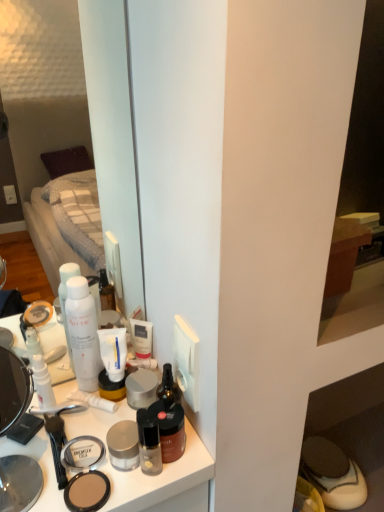
This screenshot has height=512, width=384. Describe the element at coordinates (164, 482) in the screenshot. I see `matte plastic makeup at center` at that location.

This screenshot has height=512, width=384. Identify the location of matte plastic makeup at center. (164, 482).

Describe the element at coordinates (141, 388) in the screenshot. I see `satin silver face powder at center, which is the first face powder in back-to-front order` at that location.

Find the location of a particular element. white matte spray can at center, the third toiletry in the right-to-left sequence is located at coordinates click(83, 333).

Identify the location of white matte pump bottle at upper left, which is the fourth toiletry from right to left. (43, 383).

This screenshot has width=384, height=512. In order to click on translucent glass bottle at center, which is the 2th toiletry from right to left in this screenshot , I will do `click(149, 442)`.

How different are the orientations of matte black cabinet at lower right and brown matte jar at center, which appears as the 1th toiletry when viewed from the right, in degrees?

The angle between the facing direction of matte black cabinet at lower right and the facing direction of brown matte jar at center, which appears as the 1th toiletry when viewed from the right, is 2.18 degrees.

Can you confirm if matte black cabinet at lower right is smaller than brown matte jar at center, which appears as the 1th toiletry when viewed from the right?

Incorrect, matte black cabinet at lower right is not smaller in size than brown matte jar at center, which appears as the 1th toiletry when viewed from the right.

Does matte black cabinet at lower right appear on the left side of brown matte jar at center, which appears as the 1th toiletry when viewed from the right?

Incorrect, matte black cabinet at lower right is not on the left side of brown matte jar at center, which appears as the 1th toiletry when viewed from the right.

From the image's perspective, does matte black cabinet at lower right appear lower than brown matte jar at center, which appears as the 1th toiletry when viewed from the right?

Correct, matte black cabinet at lower right appears lower than brown matte jar at center, which appears as the 1th toiletry when viewed from the right, in the image.

Considering the relative sizes of matte black compact at center, the 1th face powder when ordered from front to back, and white matte pump bottle at upper left, the first toiletry viewed from the left, in the image provided, is matte black compact at center, the 1th face powder when ordered from front to back, shorter than white matte pump bottle at upper left, the first toiletry viewed from the left,?

Yes.

Choose the correct answer: Is matte black compact at center, marked as the third face powder in a back-to-front arrangement, inside white matte pump bottle at upper left, the first toiletry viewed from the left, or outside it?

matte black compact at center, marked as the third face powder in a back-to-front arrangement, exists outside the volume of white matte pump bottle at upper left, the first toiletry viewed from the left.

Is point (182, 421) less distant than point (78, 301)?

Yes, point (182, 421) is in front of point (78, 301).

In the scene shown: How far apart are brown matte jar at center, which ranks as the fourth toiletry in left-to-right order, and white matte spray can at center, the third toiletry in the right-to-left sequence?

A distance of 9.22 inches exists between brown matte jar at center, which ranks as the fourth toiletry in left-to-right order, and white matte spray can at center, the third toiletry in the right-to-left sequence.

Locate an element on the screen. toiletry that is the 1st one when counting backward from the brown matte jar at center, which ranks as the fourth toiletry in left-to-right order is located at coordinates (83, 333).

From a real-world perspective, is matte black cabinet at lower right located beneath transparent plastic mirror at upper left?

Yes, from a real-world perspective, matte black cabinet at lower right is below transparent plastic mirror at upper left.

Is matte black cabinet at lower right facing away from transparent plastic mirror at upper left?

matte black cabinet at lower right is not turned away from transparent plastic mirror at upper left.

Consider the image. How different are the orientations of matte black cabinet at lower right and transparent plastic mirror at upper left in degrees?

There is a 0.000876-degree angle between the facing directions of matte black cabinet at lower right and transparent plastic mirror at upper left.

Which of these two, matte black cabinet at lower right or transparent plastic mirror at upper left, is wider?

Wider between the two is matte black cabinet at lower right.

Is there a large distance between matte silver jar at center, arranged as the 2th face powder when viewed from the back, and matte plastic makeup at center?

No, matte silver jar at center, arranged as the 2th face powder when viewed from the back, is not far away from matte plastic makeup at center.

How much distance is there between matte silver jar at center, the second face powder from the front, and matte plastic makeup at center?

They are 10.33 centimeters apart.

Which is in front, matte silver jar at center, arranged as the 2th face powder when viewed from the back, or matte plastic makeup at center?

matte plastic makeup at center is in front.

Consider the image. Is matte silver jar at center, the second face powder from the front, situated inside matte plastic makeup at center or outside?

matte silver jar at center, the second face powder from the front, cannot be found inside matte plastic makeup at center.

Is point (47, 496) behind point (94, 373)?

No.

Is matte plastic makeup at center positioned beyond the bounds of white matte spray can at center, the second toiletry when ordered from left to right?

Absolutely, matte plastic makeup at center is external to white matte spray can at center, the second toiletry when ordered from left to right.

How many degrees apart are the facing directions of matte plastic makeup at center and white matte spray can at center, the third toiletry in the right-to-left sequence?

2.17 degrees.

Considering the relative positions of matte plastic makeup at center and white matte spray can at center, the third toiletry in the right-to-left sequence, in the image provided, is matte plastic makeup at center behind white matte spray can at center, the third toiletry in the right-to-left sequence,?

No, the depth of matte plastic makeup at center is less than that of white matte spray can at center, the third toiletry in the right-to-left sequence.

Is there a large distance between brown matte jar at center, which appears as the 1th toiletry when viewed from the right, and matte silver jar at center, the second face powder from the front?

No.

Which is more to the left, brown matte jar at center, which appears as the 1th toiletry when viewed from the right, or matte silver jar at center, arranged as the 2th face powder when viewed from the back?

matte silver jar at center, arranged as the 2th face powder when viewed from the back, is more to the left.

Is brown matte jar at center, which appears as the 1th toiletry when viewed from the right, not inside matte silver jar at center, arranged as the 2th face powder when viewed from the back?

brown matte jar at center, which appears as the 1th toiletry when viewed from the right, is positioned outside matte silver jar at center, arranged as the 2th face powder when viewed from the back.

Which is behind, point (180, 407) or point (132, 440)?

The point (180, 407) is farther.

Locate an element on the screen. This screenshot has height=512, width=384. the 1st toiletry above the matte black cabinet at lower right (from a real-world perspective) is located at coordinates (172, 433).

You are a GUI agent. You are given a task and a screenshot of the screen. Output one action in this format:
    pyautogui.click(x=<x>, y=<y>)
    Task: Click on the 3rd toiletry positioned above the matte black compact at center, marked as the third face powder in a back-to-front arrangement (from the image's perspective)
    Image resolution: width=384 pixels, height=512 pixels.
    Given the screenshot: What is the action you would take?
    pyautogui.click(x=43, y=383)

Considering their positions, is matte silver jar at center, the second face powder from the front, positioned further to matte plastic makeup at center than matte black compact at center, the 1th face powder when ordered from front to back?

matte black compact at center, the 1th face powder when ordered from front to back, is positioned further to the anchor matte plastic makeup at center.

From the picture: Looking at the image, which one is located closer to matte black compact at center, marked as the third face powder in a back-to-front arrangement, white matte tube at center or matte plastic makeup at center?

Based on the image, matte plastic makeup at center appears to be nearer to matte black compact at center, marked as the third face powder in a back-to-front arrangement.

Estimate the real-world distances between objects in this image. Which object is closer to white matte pump bottle at upper left, the first toiletry viewed from the left, white matte tube at center or matte plastic makeup at center?

white matte tube at center lies closer to white matte pump bottle at upper left, the first toiletry viewed from the left, than the other object.

Estimate the real-world distances between objects in this image. Which object is closer to matte black cabinet at lower right, satin silver face powder at center, which is the first face powder in back-to-front order, or matte brown shoe at lower right?

Among the two, matte brown shoe at lower right is located nearer to matte black cabinet at lower right.

Estimate the real-world distances between objects in this image. Which object is closer to transparent plastic mirror at upper left, satin silver face powder at center, which is the first face powder in back-to-front order, or matte brown shoe at lower right?

Among the two, matte brown shoe at lower right is located nearer to transparent plastic mirror at upper left.

Consider the image. Estimate the real-world distances between objects in this image. Which object is closer to white matte spray can at center, the third toiletry in the right-to-left sequence, matte silver jar at center, arranged as the 2th face powder when viewed from the back, or brown matte jar at center, which ranks as the fourth toiletry in left-to-right order?

matte silver jar at center, arranged as the 2th face powder when viewed from the back.

Based on their spatial positions, is matte plastic makeup at center or white matte pump bottle at upper left, the first toiletry viewed from the left, further from matte black compact at center, marked as the third face powder in a back-to-front arrangement?

Based on the image, white matte pump bottle at upper left, the first toiletry viewed from the left, appears to be further to matte black compact at center, marked as the third face powder in a back-to-front arrangement.

From the image, which object appears to be nearer to white matte spray can at center, the second toiletry when ordered from left to right, matte black compact at center, the 1th face powder when ordered from front to back, or transparent plastic mirror at upper left?

Based on the image, matte black compact at center, the 1th face powder when ordered from front to back, appears to be nearer to white matte spray can at center, the second toiletry when ordered from left to right.

This screenshot has height=512, width=384. In order to click on mirror situated between white matte pump bottle at upper left, which is the fourth toiletry from right to left, and matte brown shoe at lower right from left to right in this screenshot , I will do `click(73, 127)`.

The width and height of the screenshot is (384, 512). In order to click on toothpaste that lies between transparent plastic mirror at upper left and white matte pump bottle at upper left, the first toiletry viewed from the left, from top to bottom in this screenshot , I will do `click(113, 352)`.

The height and width of the screenshot is (512, 384). What are the coordinates of `toothpaste between matte black compact at center, marked as the third face powder in a back-to-front arrangement, and matte black cabinet at lower right from left to right` in the screenshot? It's located at (113, 352).

The image size is (384, 512). What are the coordinates of `toothpaste between white matte spray can at center, the third toiletry in the right-to-left sequence, and matte black cabinet at lower right` in the screenshot? It's located at (113, 352).